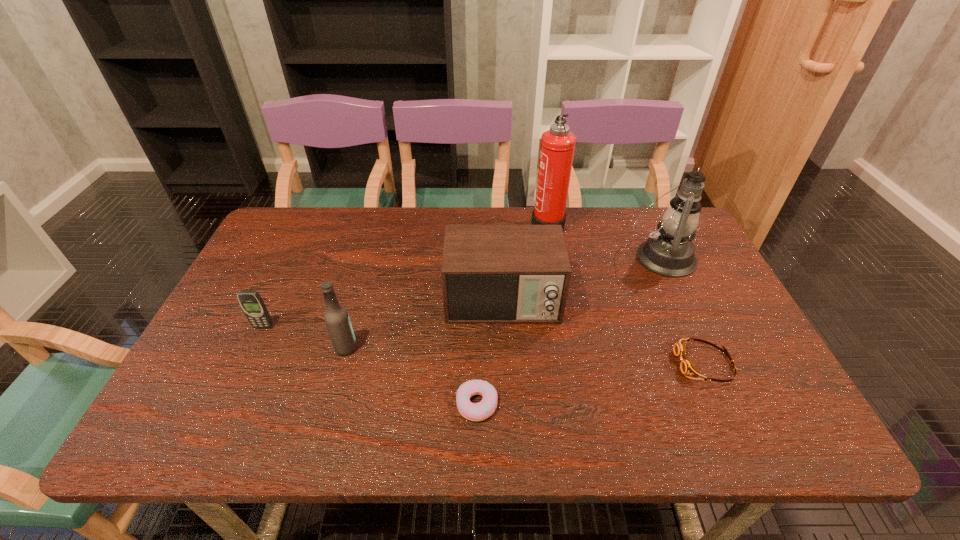
Where is `vacant area located 0.130m on the right of the shortest object`? vacant area located 0.130m on the right of the shortest object is located at coordinates (558, 404).

The image size is (960, 540). Find the location of `fire extinguisher that is at the far edge`. fire extinguisher that is at the far edge is located at coordinates (557, 147).

Where is `oil lamp present at the far edge`? oil lamp present at the far edge is located at coordinates (669, 252).

You are a GUI agent. You are given a task and a screenshot of the screen. Output one action in this format:
    pyautogui.click(x=<x>, y=<y>)
    Task: Click on the object situated at the near edge
    The width and height of the screenshot is (960, 540).
    Given the screenshot: What is the action you would take?
    pyautogui.click(x=485, y=408)

Image resolution: width=960 pixels, height=540 pixels. In order to click on object situated at the left edge in this screenshot , I will do `click(252, 304)`.

The height and width of the screenshot is (540, 960). Find the location of `oil lamp at the right edge`. oil lamp at the right edge is located at coordinates (669, 252).

Where is `goggles situated at the right edge`? This screenshot has width=960, height=540. goggles situated at the right edge is located at coordinates (687, 367).

The image size is (960, 540). Find the location of `object that is positioned at the far right corner`. object that is positioned at the far right corner is located at coordinates (669, 252).

The height and width of the screenshot is (540, 960). Identify the location of vacant area at the far edge. (611, 248).

The height and width of the screenshot is (540, 960). In order to click on vacant space at the near edge of the desktop in this screenshot , I will do `click(431, 423)`.